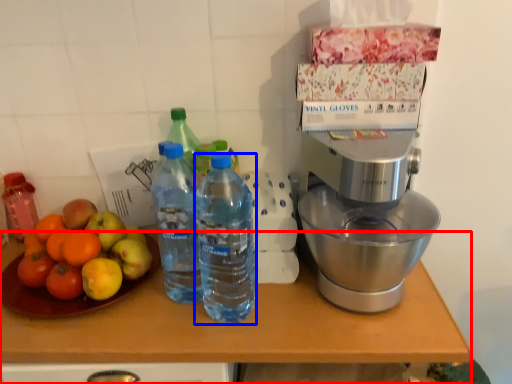
Question: Which object is closer to the camera taking this photo, table (highlighted by a red box) or bottle (highlighted by a blue box)?

Choices:
 (A) table
 (B) bottle

Answer: (B)